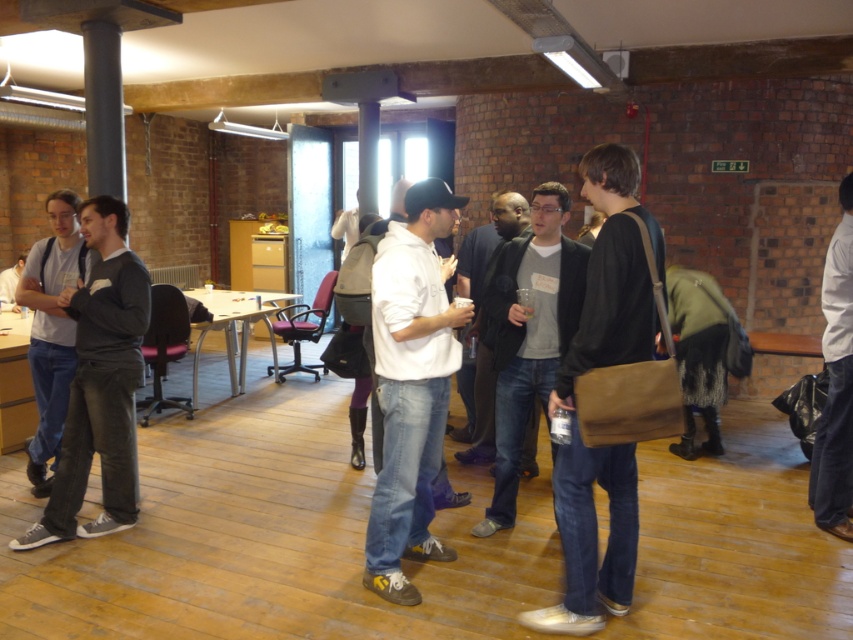
Question: Which of the following is the closest to the observer?

Choices:
 (A) (479, 456)
 (B) (498, 401)
 (C) (4, 276)
 (D) (70, 508)

Answer: (B)

Question: Which point is closer to the camera?

Choices:
 (A) dark brown leather jacket at center
 (B) white matte hoodie at center
 (C) dark gray jacket at center
 (D) white hoodie at center

Answer: (A)

Question: Is dark brown leather jacket at center to the left of dark gray jeans at left from the viewer's perspective?

Choices:
 (A) yes
 (B) no

Answer: (B)

Question: Which is farther from the white matte jacket at right?

Choices:
 (A) dark brown leather jacket at center
 (B) white matte hoodie at center

Answer: (B)

Question: Does dark gray jeans at center lie in front of dark gray jacket at center?

Choices:
 (A) no
 (B) yes

Answer: (B)

Question: Does dark brown leather jacket at center appear on the left side of white matte hoodie at center?

Choices:
 (A) yes
 (B) no

Answer: (B)